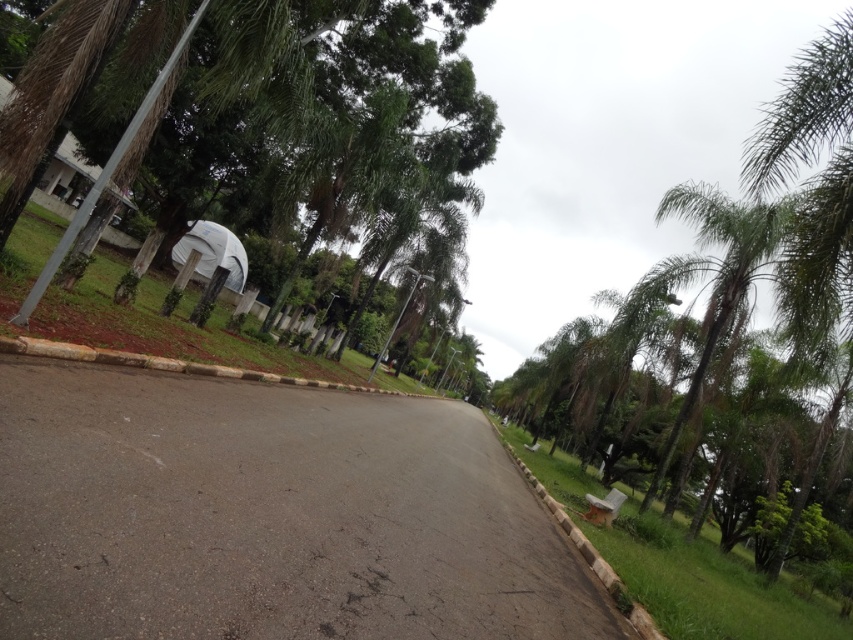
Does green leafy tree at upper left appear on the left side of green leafy palm tree at right?

Yes, green leafy tree at upper left is to the left of green leafy palm tree at right.

Is point (445, 74) in front of point (782, 230)?

No.

Image resolution: width=853 pixels, height=640 pixels. I want to click on green leafy tree at upper left, so click(325, 99).